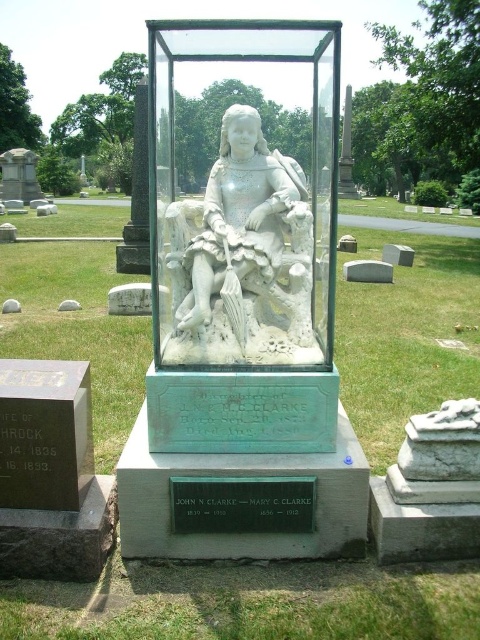
Is point (215, 230) positioned in front of point (259, 493)?

No, it is behind (259, 493).

Is transparent glass statue at center to the right of black metal plaque at center from the viewer's perspective?

No, transparent glass statue at center is not to the right of black metal plaque at center.

Does point (191, 396) come in front of point (205, 512)?

No, (191, 396) is further to viewer.

This screenshot has width=480, height=640. Find the location of `transparent glass statue at center`. transparent glass statue at center is located at coordinates (243, 236).

Who is lower down, white marble statue at center or black metal plaque at center?

black metal plaque at center is below.

Measure the distance between point (204, 209) and camera.

They are 3.38 meters apart.

Find the location of a particular element. white marble statue at center is located at coordinates (244, 236).

Can you confirm if transparent glass statue at center is wider than white marble statue at center?

Yes.

Which is behind, point (309, 216) or point (212, 230)?

The point (309, 216) is more distant.

The image size is (480, 640). I want to click on transparent glass statue at center, so click(243, 236).